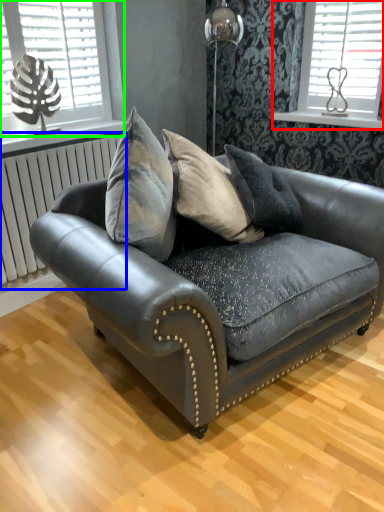
Question: Which object is positioned farthest from window (highlighted by a red box)? Select from radiator (highlighted by a blue box) and window (highlighted by a green box).

Choices:
 (A) radiator
 (B) window

Answer: (A)